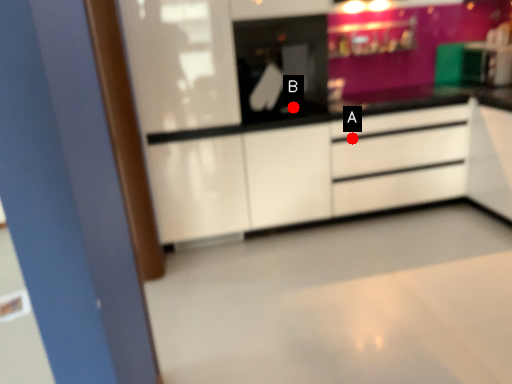
Question: Two points are circled on the image, labeled by A and B beside each circle. Which point is further to the camera?

Choices:
 (A) A is further
 (B) B is further

Answer: (A)